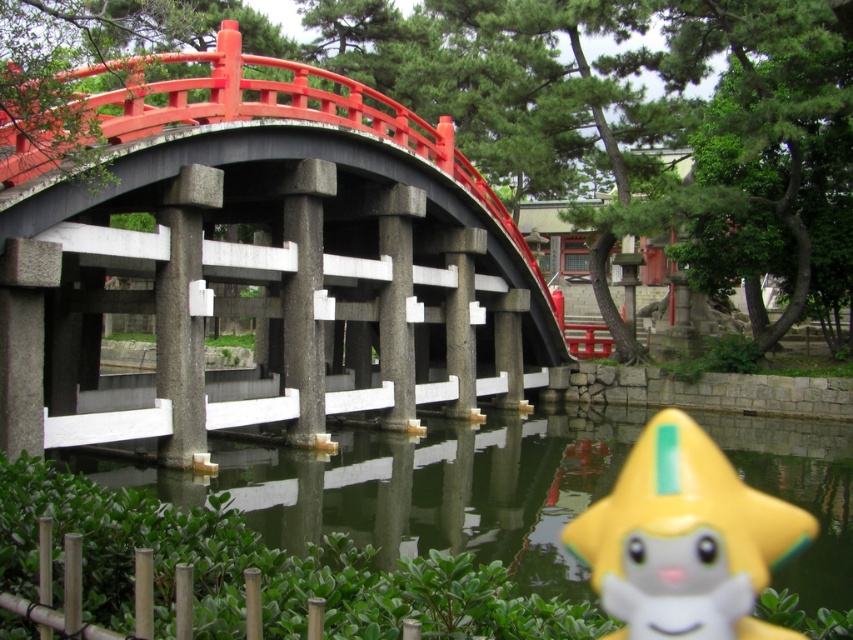
Question: Which of these objects is positioned farthest from the green matte water at lower center?

Choices:
 (A) yellow matte star at lower right
 (B) smooth stone bridge at center

Answer: (B)

Question: Can you confirm if green matte water at lower center is positioned above yellow matte star at lower right?

Choices:
 (A) no
 (B) yes

Answer: (B)

Question: Which object appears closest to the camera in this image?

Choices:
 (A) green matte water at lower center
 (B) smooth stone bridge at center
 (C) yellow matte star at lower right

Answer: (C)

Question: Is smooth stone bridge at center below green matte water at lower center?

Choices:
 (A) no
 (B) yes

Answer: (A)

Question: Which point is closer to the camera?

Choices:
 (A) green matte water at lower center
 (B) smooth stone bridge at center

Answer: (A)

Question: Observing the image, what is the correct spatial positioning of smooth stone bridge at center in reference to green matte water at lower center?

Choices:
 (A) left
 (B) right

Answer: (A)